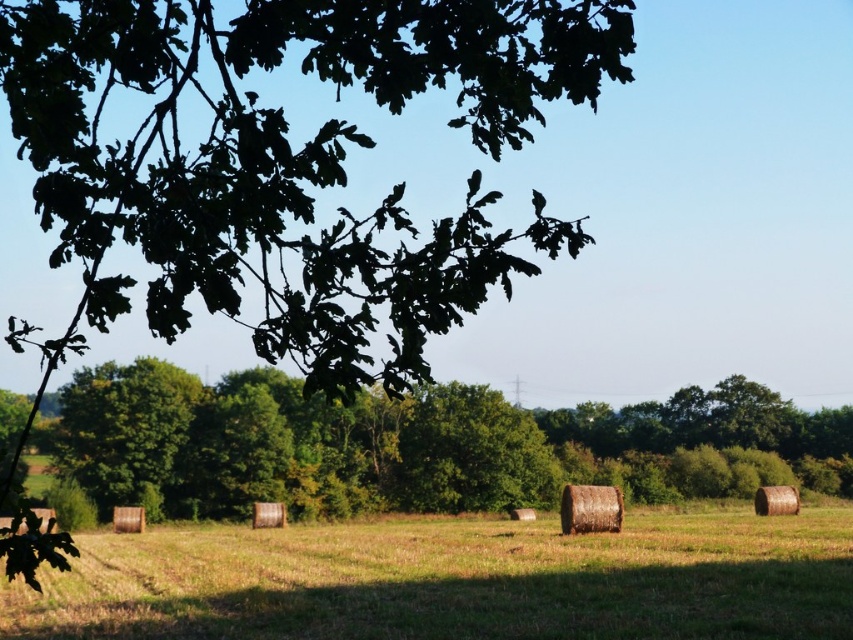
Question: Can you confirm if green grass at center is thinner than green leafy tree at center?

Choices:
 (A) yes
 (B) no

Answer: (A)

Question: Considering the relative positions of green grass at center and green leafy tree at center in the image provided, where is green grass at center located with respect to green leafy tree at center?

Choices:
 (A) above
 (B) below

Answer: (B)

Question: Does green grass at center appear under green leafy tree at center?

Choices:
 (A) no
 (B) yes

Answer: (B)